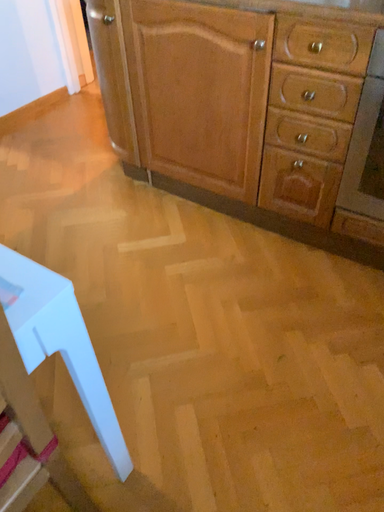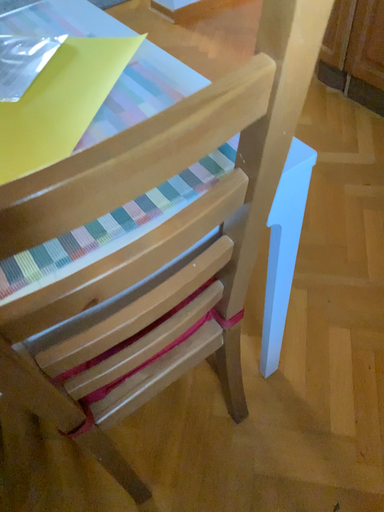
Question: Which way did the camera rotate in the video?

Choices:
 (A) rotated upward
 (B) rotated downward

Answer: (B)